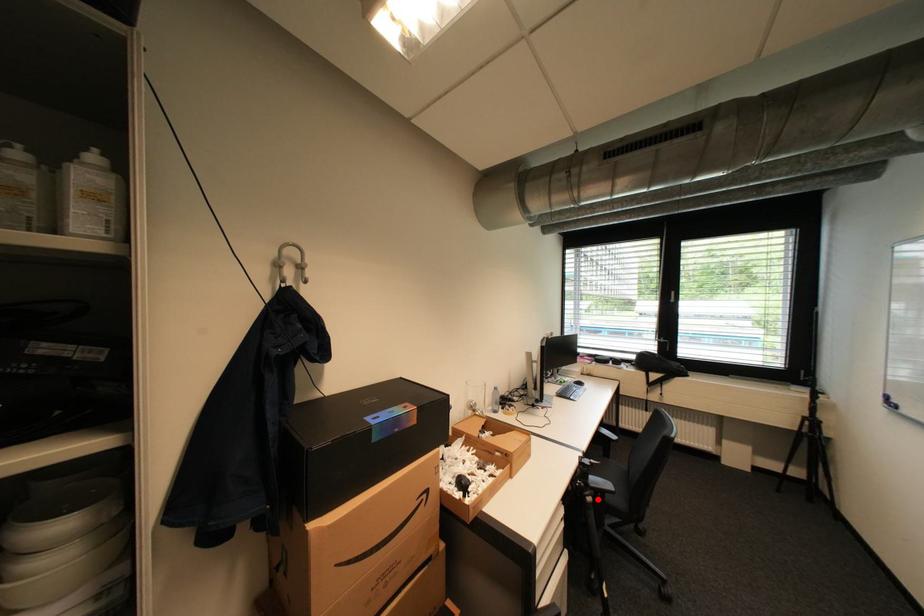
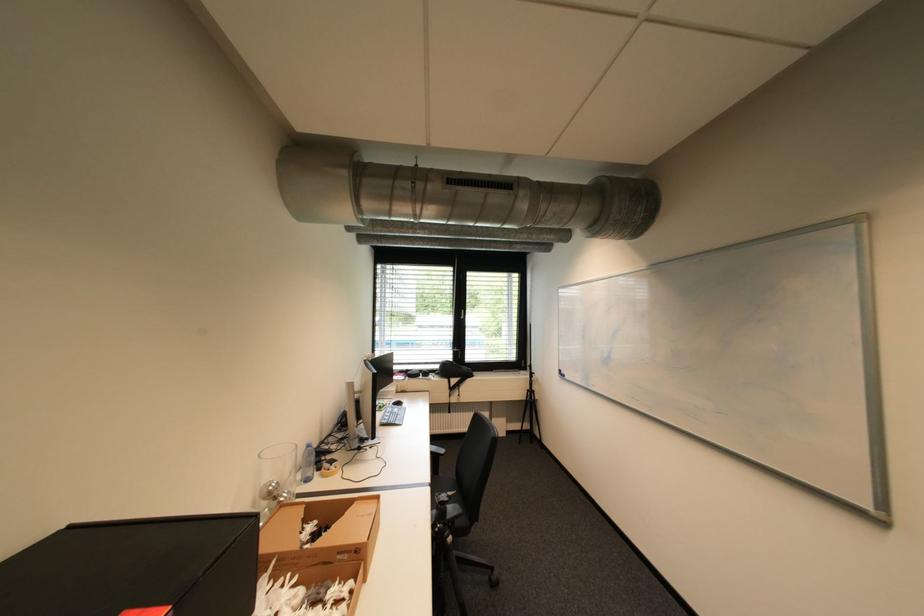
Question: I am providing you with two images of the same scene from different viewpoints. A red point is shown in image1. For the corresponding object point in image2, is it positioned nearer or farther from the camera?

Choices:
 (A) Nearer
 (B) Farther

Answer: (A)